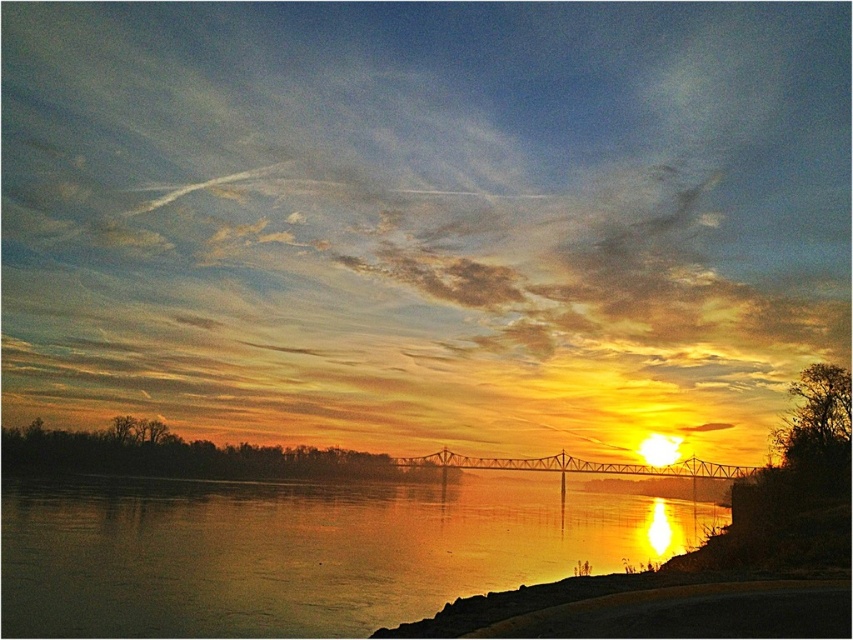
Question: Can you confirm if glossy water at center is positioned above metallic bridge at center?

Choices:
 (A) no
 (B) yes

Answer: (B)

Question: Among these objects, which one is farthest from the camera?

Choices:
 (A) metallic bridge at center
 (B) glossy water at center

Answer: (A)

Question: Can you confirm if glossy water at center is thinner than metallic bridge at center?

Choices:
 (A) yes
 (B) no

Answer: (B)

Question: Which point is farther to the camera?

Choices:
 (A) (641, 467)
 (B) (462, 483)

Answer: (A)

Question: Where is glossy water at center located in relation to metallic bridge at center in the image?

Choices:
 (A) left
 (B) right

Answer: (A)

Question: Which of the following is the closest to the observer?

Choices:
 (A) glossy water at center
 (B) metallic bridge at center

Answer: (A)